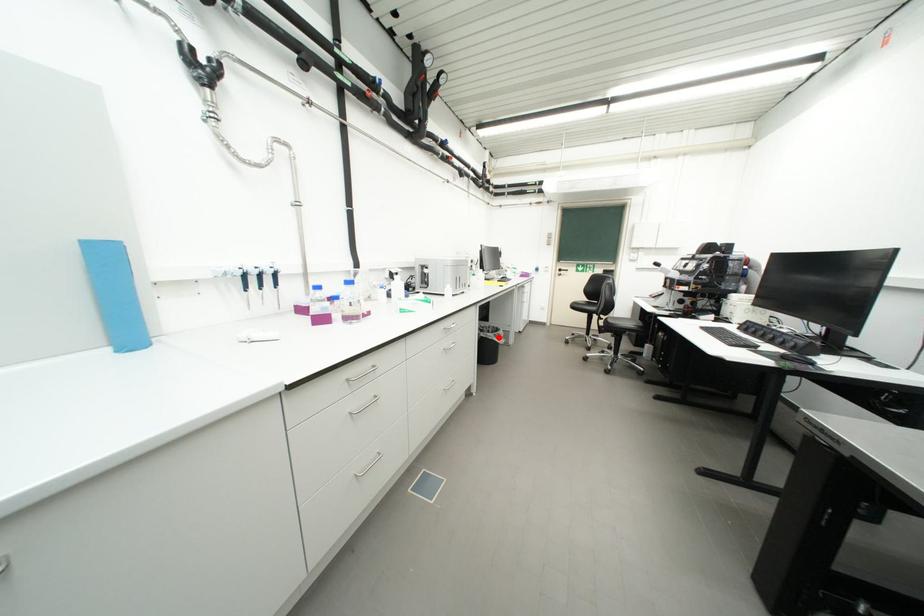
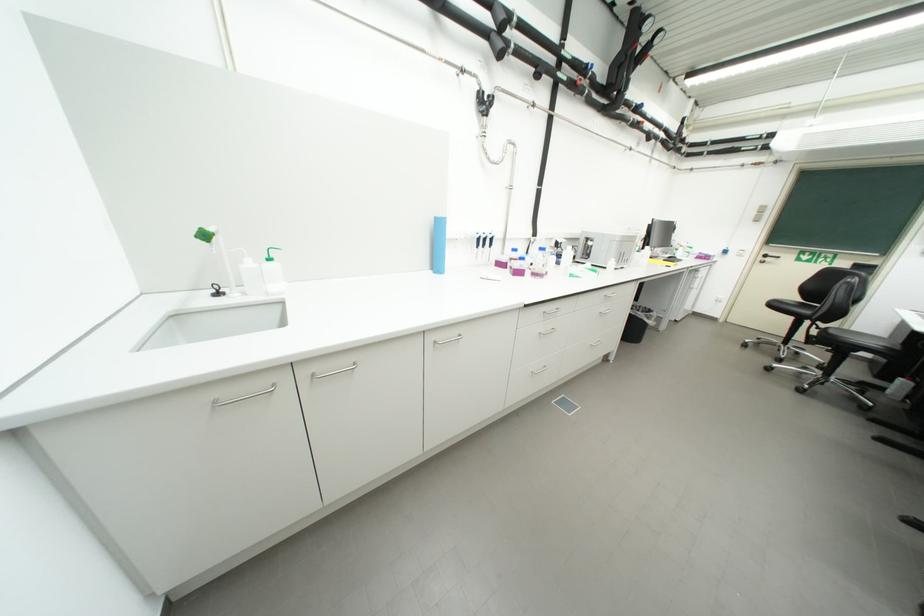
Where in the second image is the point corresponding to the highlighted location from the first image?

(649, 317)